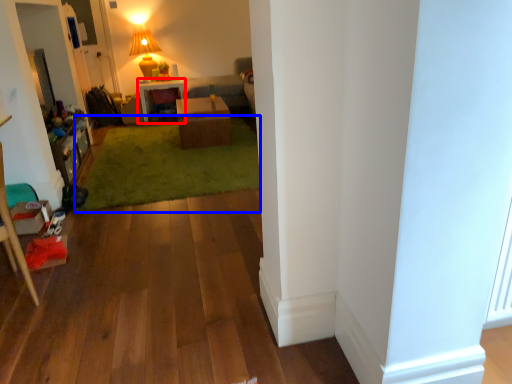
Question: Which of the following is the closest to the observer, desk (highlighted by a red box) or grass (highlighted by a blue box)?

Choices:
 (A) desk
 (B) grass

Answer: (B)